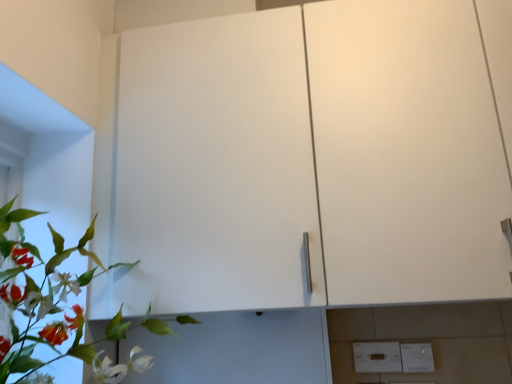
Question: Should I look upward or downward to see green leafy plant at left?

Choices:
 (A) up
 (B) down

Answer: (B)